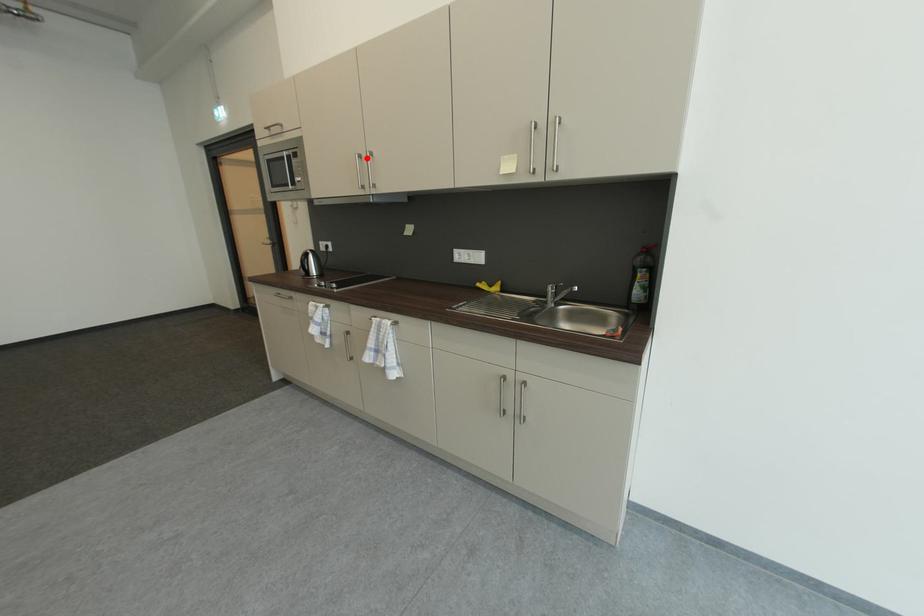
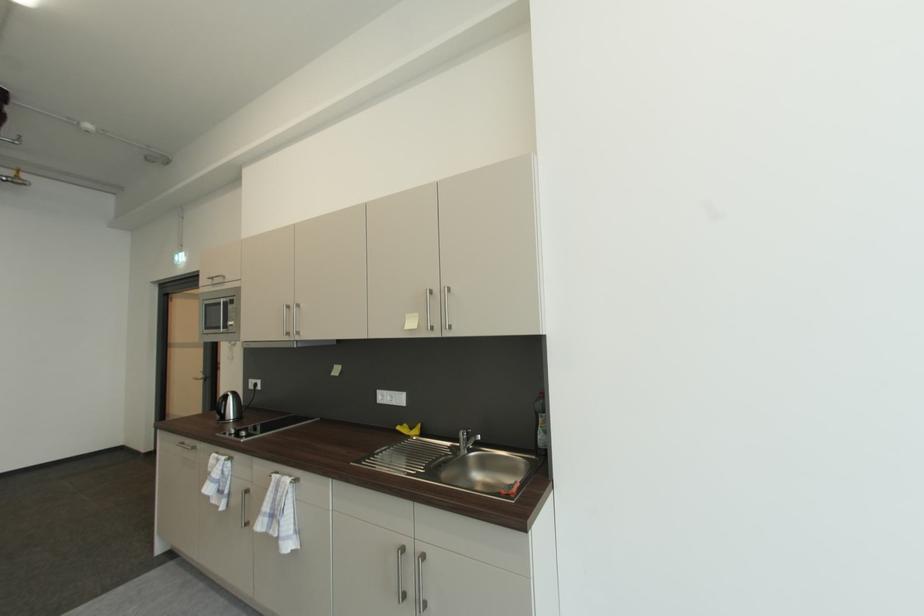
Question: I am providing you with two images of the same scene from different viewpoints. Given a red point in image1, look at the same physical point in image2. Is it:

Choices:
 (A) Closer to the viewpoint
 (B) Farther from the viewpoint

Answer: (B)